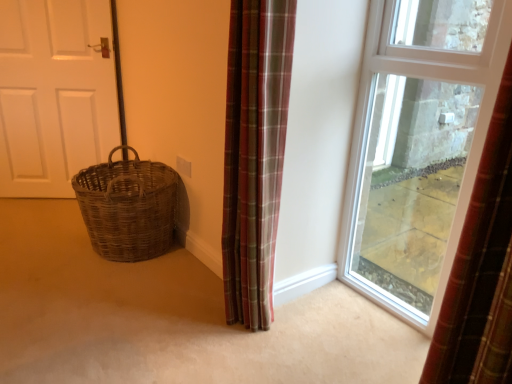
Question: Looking at the image, does woven wicker basket at left seem bigger or smaller compared to woven brown basket at lower left?

Choices:
 (A) big
 (B) small

Answer: (A)

Question: From the image's perspective, is woven wicker basket at left located above or below woven brown basket at lower left?

Choices:
 (A) below
 (B) above

Answer: (A)

Question: Estimate the real-world distances between objects in this image. Which object is farther from the plaid fabric curtain at center?

Choices:
 (A) woven brown basket at lower left
 (B) woven wicker basket at left
 (C) clear glass window at center
 (D) white matte door at left

Answer: (D)

Question: Which of these objects is positioned farthest from the plaid fabric curtain at center?

Choices:
 (A) clear glass window at center
 (B) white matte door at left
 (C) woven brown basket at lower left
 (D) woven wicker basket at left

Answer: (B)